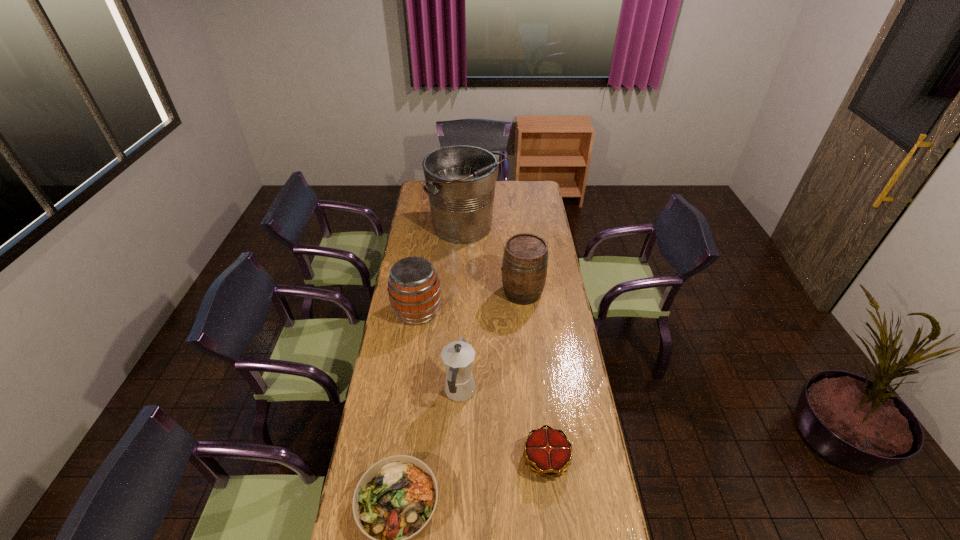
Locate an element on the screen. empty space that is in between the right cider and the farthest object is located at coordinates (494, 260).

You are a GUI agent. You are given a task and a screenshot of the screen. Output one action in this format:
    pyautogui.click(x=<x>, y=<y>)
    Task: Click on the unoccupied position between the right cider and the farthest object
    This screenshot has height=540, width=960.
    Given the screenshot: What is the action you would take?
    pyautogui.click(x=494, y=260)

At what (x,y) coordinates should I click in order to perform the action: click on free space between the left cider and the crown. Please return your answer as a coordinate pair (x, y). The height and width of the screenshot is (540, 960). Looking at the image, I should click on (482, 385).

Image resolution: width=960 pixels, height=540 pixels. What are the coordinates of `vacant region between the crown and the right cider` in the screenshot? It's located at (534, 375).

Locate an element on the screen. This screenshot has height=540, width=960. vacant space in between the right cider and the left cider is located at coordinates (469, 302).

Image resolution: width=960 pixels, height=540 pixels. In order to click on empty space between the coffeepot and the left cider in this screenshot , I will do `click(439, 352)`.

You are a GUI agent. You are given a task and a screenshot of the screen. Output one action in this format:
    pyautogui.click(x=<x>, y=<y>)
    Task: Click on the empty space that is in between the farthest object and the right cider
    Image resolution: width=960 pixels, height=540 pixels.
    Given the screenshot: What is the action you would take?
    pyautogui.click(x=494, y=260)

Locate an element on the screen. This screenshot has height=540, width=960. vacant space that's between the left cider and the crown is located at coordinates (482, 385).

At what (x,y) coordinates should I click in order to perform the action: click on unoccupied position between the tallest object and the left cider. Please return your answer as a coordinate pair (x, y). This screenshot has height=540, width=960. Looking at the image, I should click on (442, 270).

Identify the location of object that stands as the third closest to the farthest object. The width and height of the screenshot is (960, 540). (458, 356).